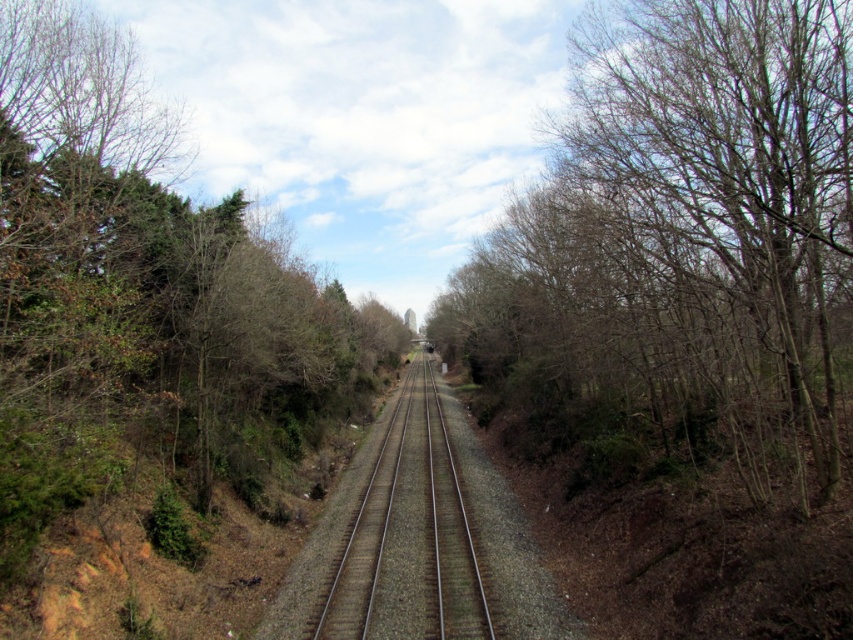
Question: Is bare branches at center above metal train track at center?

Choices:
 (A) no
 (B) yes

Answer: (B)

Question: Which point is farther to the camera?

Choices:
 (A) metal train track at center
 (B) bare branches at center

Answer: (A)

Question: Is bare branches at center thinner than metal train track at center?

Choices:
 (A) no
 (B) yes

Answer: (A)

Question: Is bare branches at center positioned at the back of metal train track at center?

Choices:
 (A) yes
 (B) no

Answer: (B)

Question: Among these points, which one is farthest from the camera?

Choices:
 (A) (393, 486)
 (B) (589, 308)

Answer: (A)